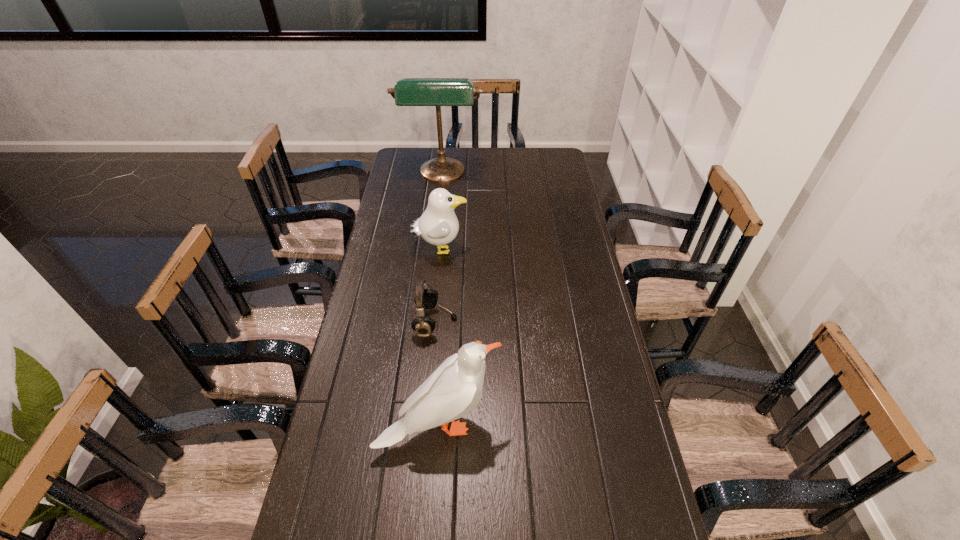
This screenshot has width=960, height=540. Identify the location of empty space that is in between the nearer gull and the tallest object. (441, 300).

Identify the location of the third closest object to the nearer gull. (437, 92).

Identify which object is located as the nearest to the nearer gull. Please provide its 2D coordinates. Your answer should be formatted as a tuple, i.e. [(x, y)], where the tuple contains the x and y coordinates of a point satisfying the conditions above.

[(425, 298)]